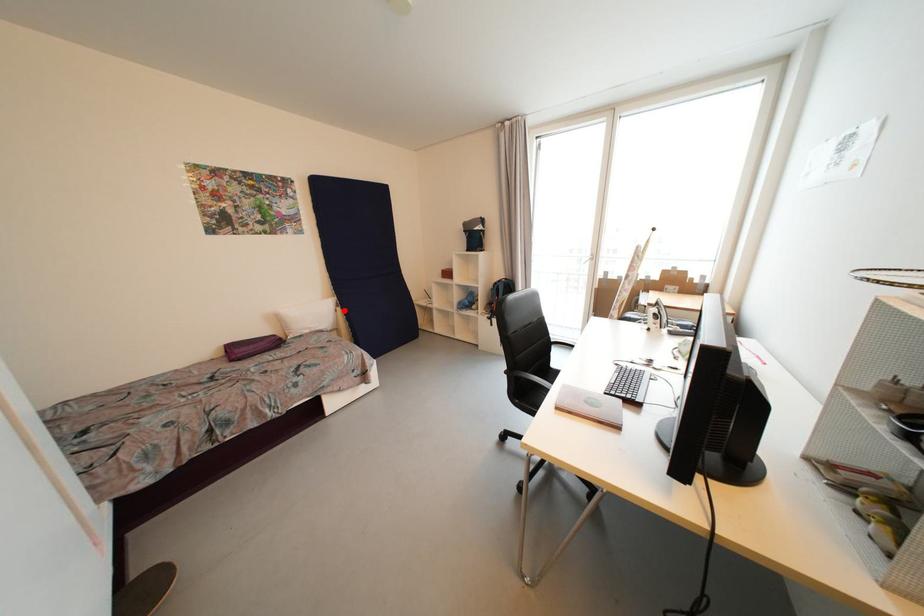
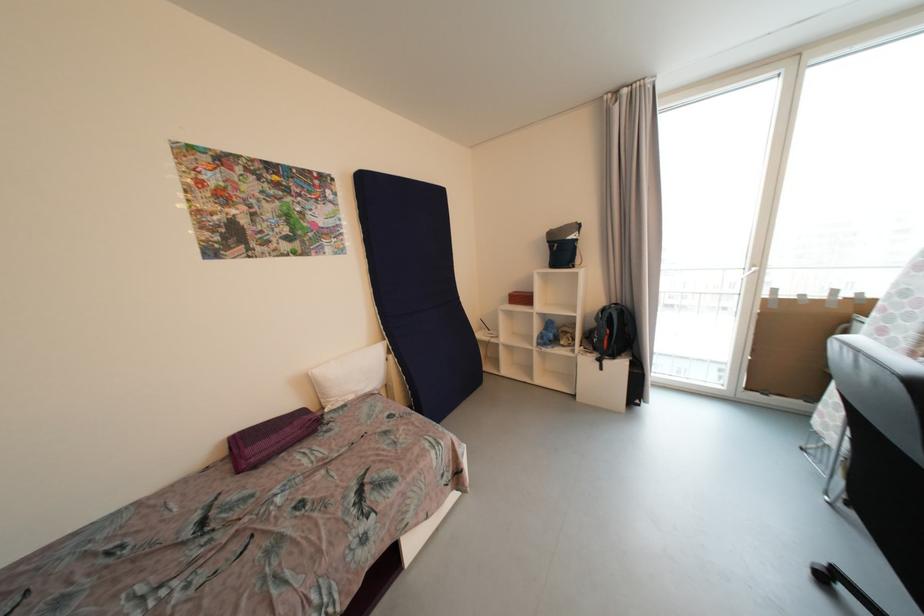
Where in the second image is the point corresponding to the highlighted location from the first image?

(396, 359)